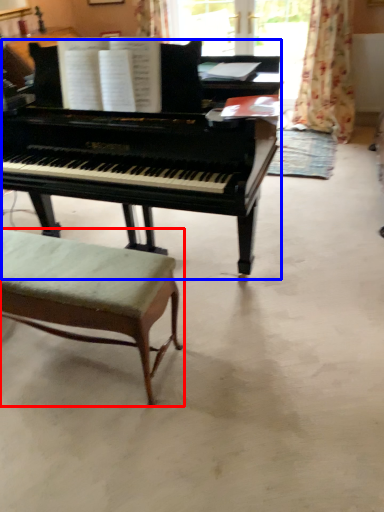
Question: Which object is further to the camera taking this photo, stool (highlighted by a red box) or piano (highlighted by a blue box)?

Choices:
 (A) stool
 (B) piano

Answer: (A)